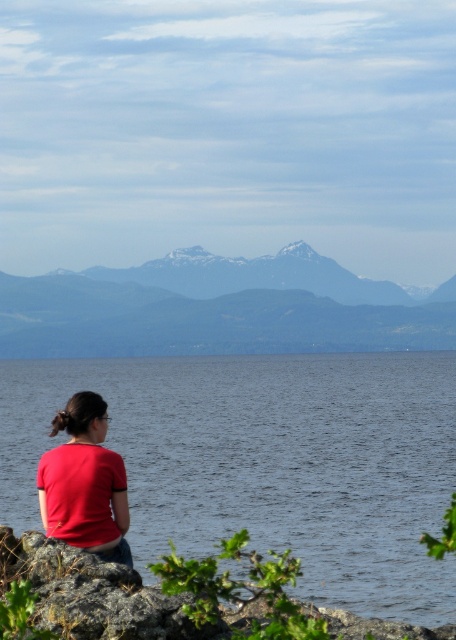
Question: Is blue water at center thinner than matte red shirt at lower left?

Choices:
 (A) yes
 (B) no

Answer: (B)

Question: Which of the following is the farthest from the observer?

Choices:
 (A) matte red shirt at lower left
 (B) snowy rocky mountain at center
 (C) blue water at center

Answer: (B)

Question: Is blue water at center positioned at the back of snowy rocky mountain at center?

Choices:
 (A) yes
 (B) no

Answer: (B)

Question: Can you confirm if blue water at center is positioned to the right of matte red shirt at lower left?

Choices:
 (A) yes
 (B) no

Answer: (A)

Question: Which object is farther from the camera taking this photo?

Choices:
 (A) blue water at center
 (B) matte red shirt at lower left

Answer: (B)

Question: Which point is farther to the camera?

Choices:
 (A) (338, 268)
 (B) (107, 518)
 (C) (294, 490)

Answer: (A)